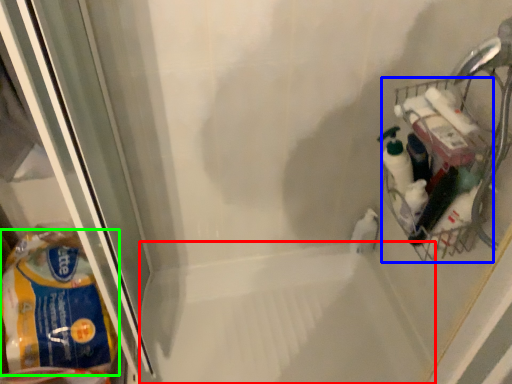
Question: Based on their relative distances, which object is nearer to bath (highlighted by a red box)? Choose from basket (highlighted by a blue box) and material (highlighted by a green box).

Choices:
 (A) basket
 (B) material

Answer: (B)